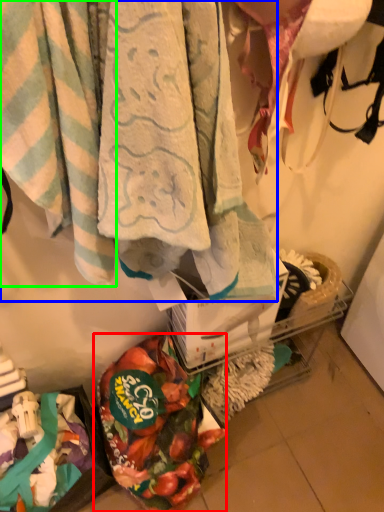
Question: Which object is the farthest from food (highlighted by a red box)? Choose among these: towel (highlighted by a blue box) or towel (highlighted by a green box).

Choices:
 (A) towel
 (B) towel

Answer: (B)